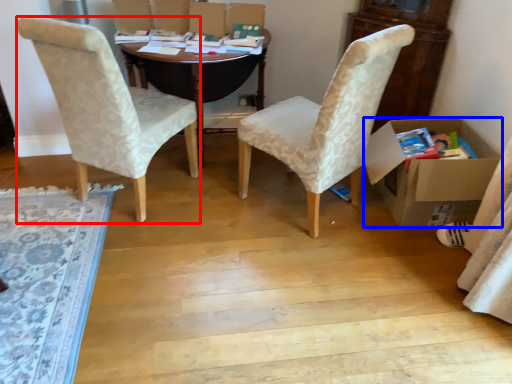
Question: Among these objects, which one is farthest to the camera, chair (highlighted by a red box) or box (highlighted by a blue box)?

Choices:
 (A) chair
 (B) box

Answer: (B)